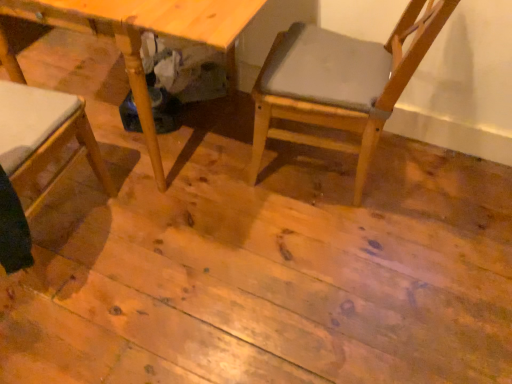
Locate an element on the screen. This screenshot has width=512, height=384. free space in front of natural wood table at center is located at coordinates (189, 275).